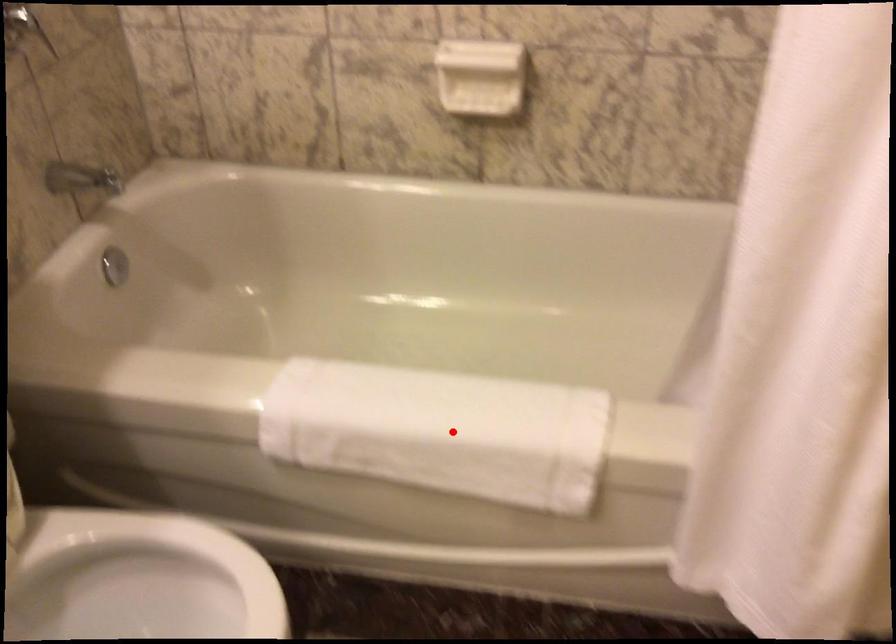
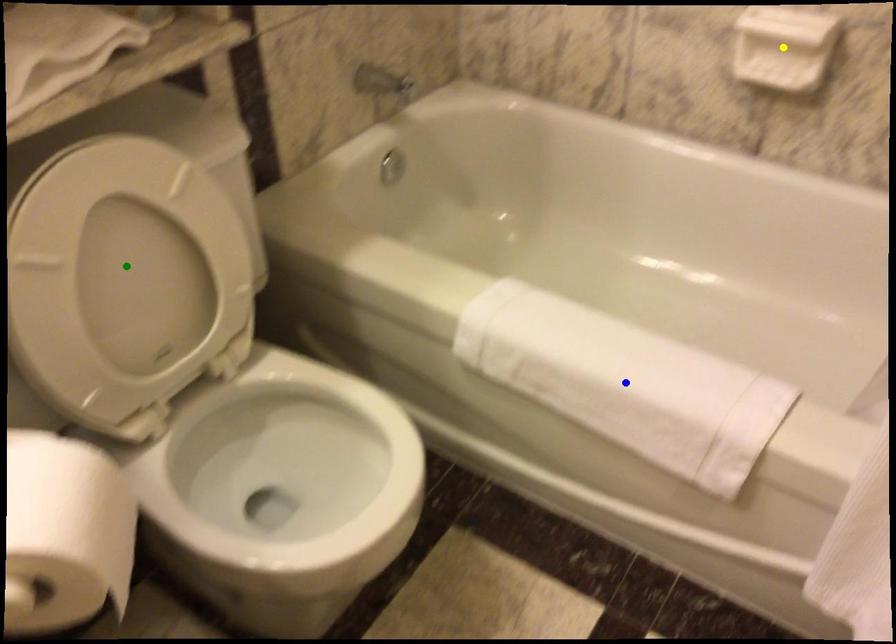
Question: I am providing you with two images of the same scene from different viewpoints. A red point is marked on the first image. You are given multiple points on the second image. Can you choose the point in image 2 that corresponds to the point in image 1?

Choices:
 (A) green point
 (B) blue point
 (C) yellow point

Answer: (B)